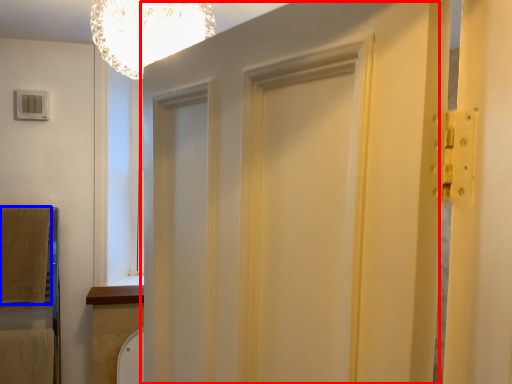
Question: Among these objects, which one is farthest to the camera, barn door (highlighted by a red box) or blanket (highlighted by a blue box)?

Choices:
 (A) barn door
 (B) blanket

Answer: (B)